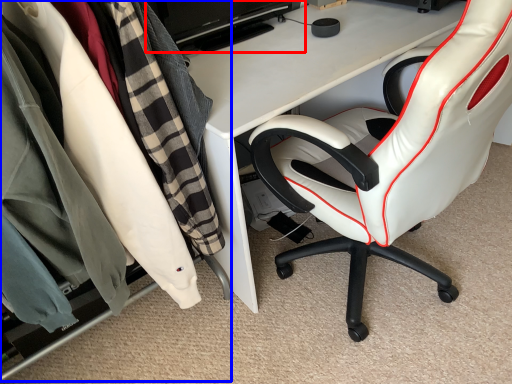
Question: Which point is closer to the camera, computer monitor (highlighted by a red box) or closet (highlighted by a blue box)?

Choices:
 (A) computer monitor
 (B) closet

Answer: (B)